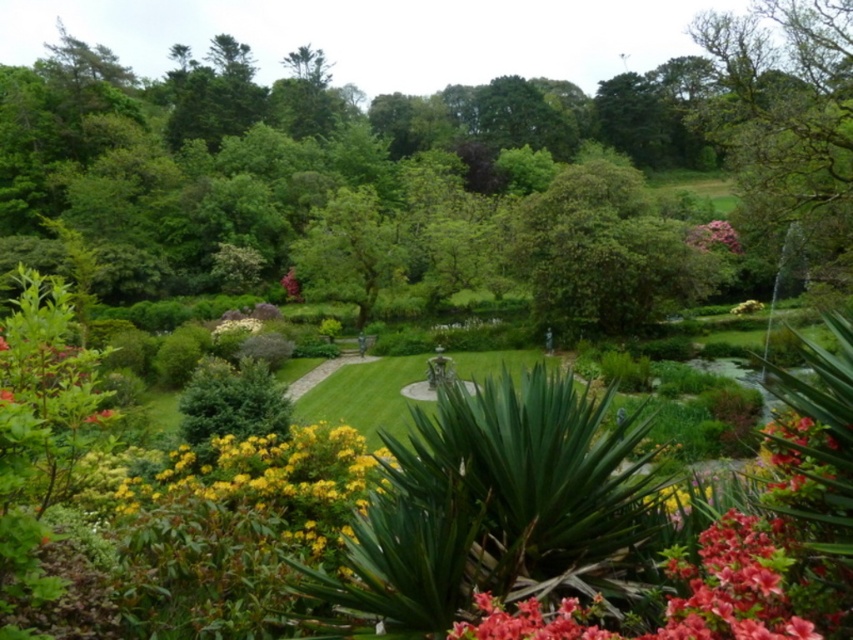
You are a gardener who needs to water the pink matte flower at center and the vivid red petals at lower right. Which one should you water first if you want to avoid getting the other wet from the sprinkler?

You should water the pink matte flower at center first because the vivid red petals at lower right is in front of it, so watering the one behind first would prevent water from splashing onto the front one.

You are a gardener who wants to place a new statue exactly at the center of the garden. The garden is represented as a coordinate system where the bottom left corner is the origin point. The pink matte flower at upper right is located at point 0.369, 0.838. What are the coordinates of the center of the garden?

The coordinates of the center of the garden would be at point (426,320) since the garden is represented as a coordinate system from 0 to 1 in both x and y axes. The pink matte flower at upper right is located at point (714,236), which is not the center point.